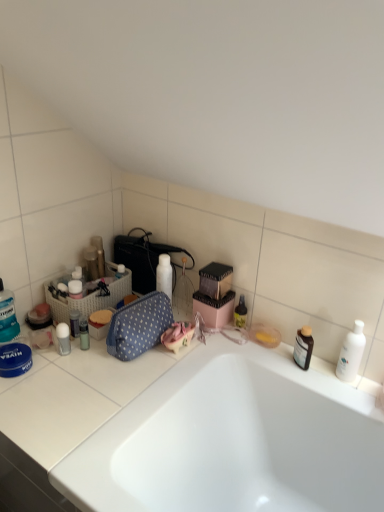
Question: Is translucent plastic tube at left, which appears as the 8th toiletry when viewed from the right, to the left or to the right of blue polka dot fabric bag at center in the image?

Choices:
 (A) right
 (B) left

Answer: (B)

Question: From a real-world perspective, is translucent plastic tube at left, which appears as the 8th toiletry when viewed from the right, above or below blue polka dot fabric bag at center?

Choices:
 (A) below
 (B) above

Answer: (A)

Question: Which object is positioned farthest from the translucent plastic tube at left, the 3th toiletry in the left-to-right sequence?

Choices:
 (A) blue polka dot fabric bag at center
 (B) matte black speaker at upper left, the 6th toiletry positioned from the left
 (C) metallic cylindrical container at upper left, positioned as the fourth toiletry in left-to-right order
 (D) translucent plastic mouthwash at left, the first toiletry viewed from the left
 (E) metallic silver container at left, the 5th toiletry viewed from the left

Answer: (C)

Question: Which of these objects is positioned closest to the matte black speaker at upper left, the 5th toiletry in the right-to-left sequence?

Choices:
 (A) translucent plastic tube at left, which appears as the 8th toiletry when viewed from the right
 (B) white glossy bottle at right, which is the 10th toiletry in left-to-right order
 (C) white woven laundry basket at left
 (D) metallic cylindrical container at upper left, positioned as the fourth toiletry in left-to-right order
 (E) metallic silver container at left, positioned as the sixth toiletry in right-to-left order

Answer: (D)